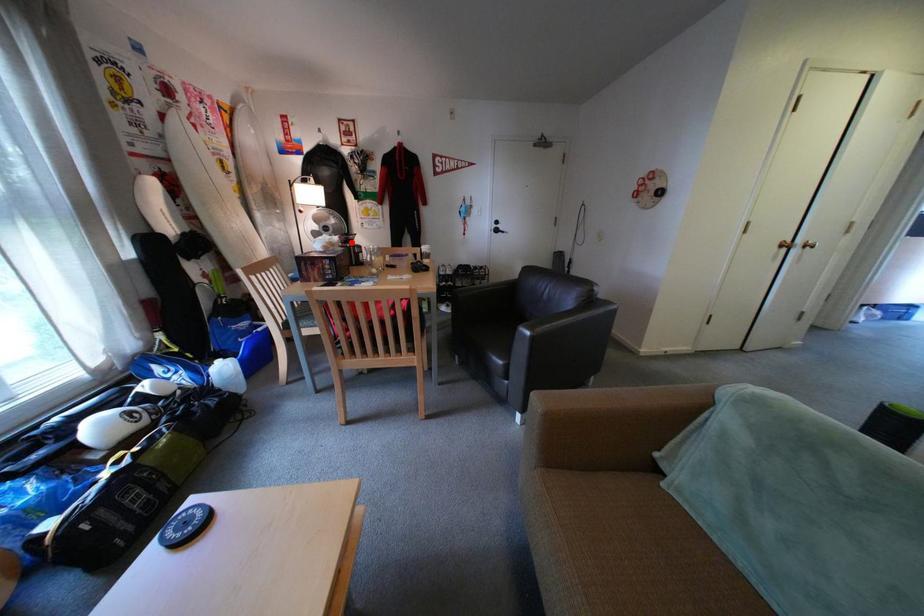
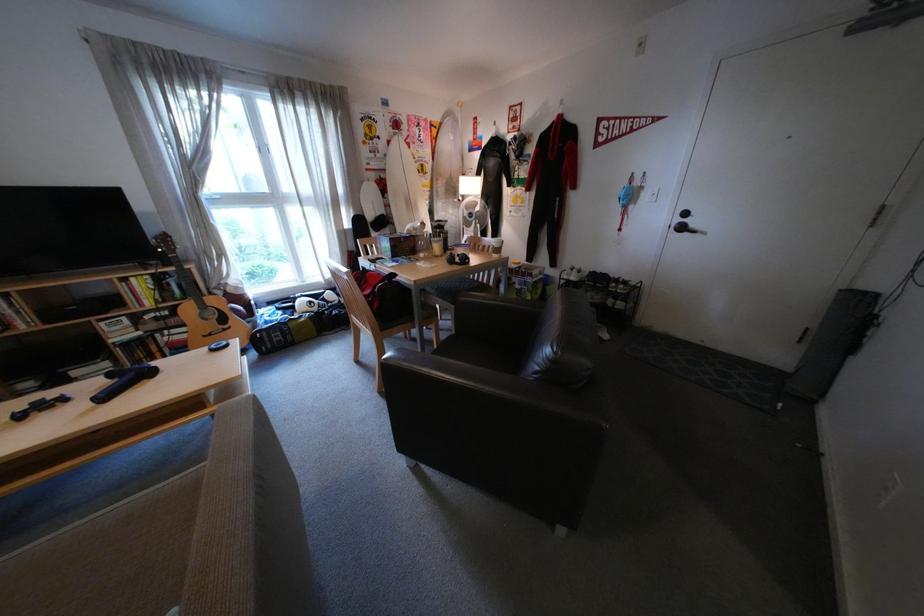
Find the pixel in the second image that matches the highlighted location in the first image.

(433, 228)